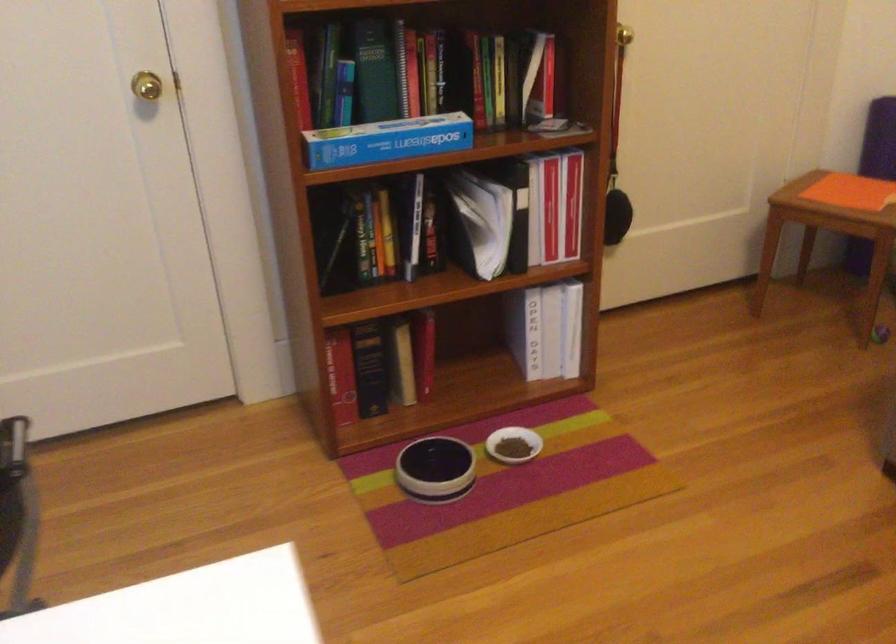
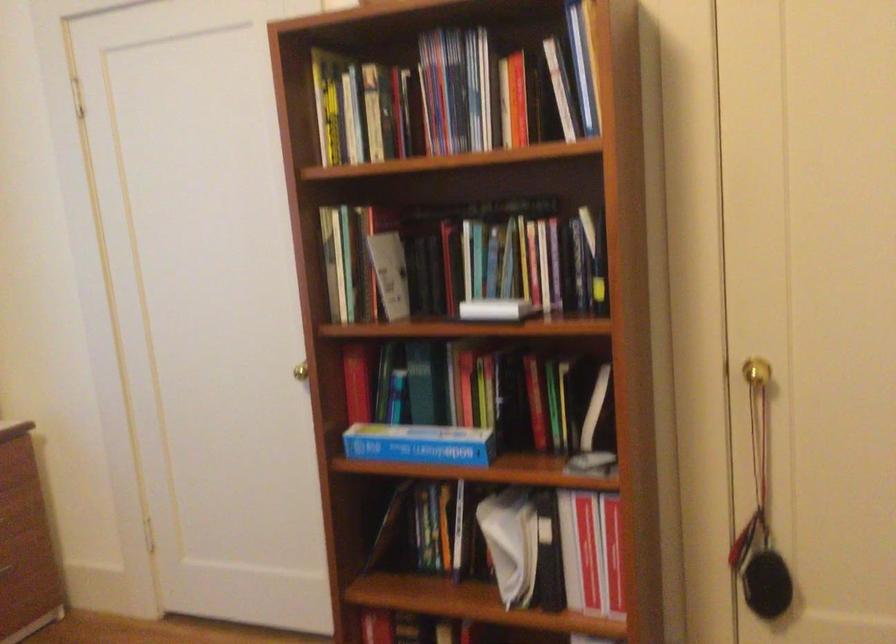
Where in the second image is the point corresponding to (364,241) from the first image?

(426, 527)